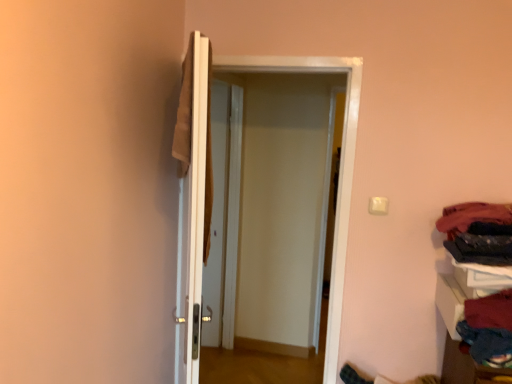
The width and height of the screenshot is (512, 384). Identify the location of velvet red sweater at lower right, which is the 1th clothing in bottom-to-top order. (488, 327).

Describe the element at coordinates (472, 216) in the screenshot. Image resolution: width=512 pixels, height=384 pixels. I see `dark blue fabric at right, the 3th clothing ordered from the bottom` at that location.

Where is `black fabric at right, positioned as the 2th clothing in bottom-to-top order`? This screenshot has width=512, height=384. black fabric at right, positioned as the 2th clothing in bottom-to-top order is located at coordinates (481, 249).

What are the coordinates of `velvet red sweater at lower right, which is the 1th clothing in bottom-to-top order` in the screenshot? It's located at (488, 327).

From a real-world perspective, who is located lower, dark blue fabric at right, the 3th clothing ordered from the bottom, or black fabric at right, arranged as the second clothing when viewed from the top?

black fabric at right, arranged as the second clothing when viewed from the top, from a real-world perspective.

Is point (473, 220) closer to viewer compared to point (457, 243)?

No, it is behind (457, 243).

Is dark blue fabric at right, which is the 1th clothing from top to bottom, in front of black fabric at right, positioned as the 2th clothing in bottom-to-top order?

No, it is not.

Is velvet red sweater at lower right, which is the 3th clothing in top-to-bottom order, oriented towards black fabric at right, arranged as the second clothing when viewed from the top?

No, velvet red sweater at lower right, which is the 3th clothing in top-to-bottom order, is not facing towards black fabric at right, arranged as the second clothing when viewed from the top.

Which point is more forward, (x=490, y=348) or (x=498, y=252)?

Point (x=490, y=348)

Is velvet red sweater at lower right, which is the 1th clothing in bottom-to-top order, positioned far away from black fabric at right, positioned as the 2th clothing in bottom-to-top order?

No, velvet red sweater at lower right, which is the 1th clothing in bottom-to-top order, is not far from black fabric at right, positioned as the 2th clothing in bottom-to-top order.

Is velvet red sweater at lower right, which is the 1th clothing in bottom-to-top order, wider than black fabric at right, arranged as the second clothing when viewed from the top?

Indeed, velvet red sweater at lower right, which is the 1th clothing in bottom-to-top order, has a greater width compared to black fabric at right, arranged as the second clothing when viewed from the top.

Can you confirm if velvet red sweater at lower right, which is the 1th clothing in bottom-to-top order, is wider than white glossy door at center, which is the second door from right to left?

Correct, the width of velvet red sweater at lower right, which is the 1th clothing in bottom-to-top order, exceeds that of white glossy door at center, which is the second door from right to left.

From the white glossy door at center, which is the second door from right to left, count 1st clothings backward and point to it. Please provide its 2D coordinates.

[(488, 327)]

Which is more to the right, velvet red sweater at lower right, which is the 1th clothing in bottom-to-top order, or white glossy door at center, which is the second door from right to left?

From the viewer's perspective, velvet red sweater at lower right, which is the 1th clothing in bottom-to-top order, appears more on the right side.

Is white glossy door at center, which is the second door from right to left, far away from black fabric at right, positioned as the 2th clothing in bottom-to-top order?

white glossy door at center, which is the second door from right to left, is far away from black fabric at right, positioned as the 2th clothing in bottom-to-top order.

What are the coordinates of `the 3rd clothing counting from the right of the white glossy door at center, which is the second door from right to left` in the screenshot? It's located at (481, 249).

Between white glossy door at center, which is the second door from right to left, and black fabric at right, arranged as the second clothing when viewed from the top, which one has more height?

white glossy door at center, which is the second door from right to left.

From a real-world perspective, relative to black fabric at right, arranged as the second clothing when viewed from the top, is white glossy door at center, which is counted as the first door, starting from the left, vertically above or below?

Clearly, from a real-world perspective, white glossy door at center, which is counted as the first door, starting from the left, is below black fabric at right, arranged as the second clothing when viewed from the top.

Between dark blue fabric at right, which is the 1th clothing from top to bottom, and velvet red sweater at lower right, which is the 1th clothing in bottom-to-top order, which one has larger width?

With larger width is dark blue fabric at right, which is the 1th clothing from top to bottom.

Considering the relative positions of dark blue fabric at right, the 3th clothing ordered from the bottom, and velvet red sweater at lower right, which is the 3th clothing in top-to-bottom order, in the image provided, is dark blue fabric at right, the 3th clothing ordered from the bottom, to the left or to the right of velvet red sweater at lower right, which is the 3th clothing in top-to-bottom order,?

In the image, dark blue fabric at right, the 3th clothing ordered from the bottom, appears on the right side of velvet red sweater at lower right, which is the 3th clothing in top-to-bottom order.

From a real-world perspective, between dark blue fabric at right, which is the 1th clothing from top to bottom, and velvet red sweater at lower right, which is the 3th clothing in top-to-bottom order, who is vertically higher?

dark blue fabric at right, which is the 1th clothing from top to bottom.

Is point (184, 257) positioned in front of point (182, 94)?

Yes.

From the image's perspective, is white glossy door at center, which is counted as the first door, starting from the right, on top of white glossy door at center, which is the second door from right to left?

Correct, white glossy door at center, which is counted as the first door, starting from the right, appears higher than white glossy door at center, which is the second door from right to left, in the image.

Based on their positions, is white glossy door at center, which is counted as the second door, starting from the left, located to the left or right of white glossy door at center, which is counted as the first door, starting from the left?

white glossy door at center, which is counted as the second door, starting from the left, is to the right of white glossy door at center, which is counted as the first door, starting from the left.

Locate an element on the screen. the 1st door to the left of the dark blue fabric at right, the 3th clothing ordered from the bottom, starting your count from the anchor is located at coordinates (192, 187).

Considering the sizes of objects dark blue fabric at right, the 3th clothing ordered from the bottom, and white glossy door at center, which is counted as the second door, starting from the left, in the image provided, who is thinner, dark blue fabric at right, the 3th clothing ordered from the bottom, or white glossy door at center, which is counted as the second door, starting from the left,?

With smaller width is white glossy door at center, which is counted as the second door, starting from the left.

Is the position of dark blue fabric at right, which is the 1th clothing from top to bottom, less distant than that of white glossy door at center, which is counted as the second door, starting from the left?

Yes.

Is dark blue fabric at right, the 3th clothing ordered from the bottom, aimed at white glossy door at center, which is counted as the second door, starting from the left?

No, dark blue fabric at right, the 3th clothing ordered from the bottom, does not turn towards white glossy door at center, which is counted as the second door, starting from the left.

Identify the location of clothing that is the 1st one when counting forward from the dark blue fabric at right, which is the 1th clothing from top to bottom. (481, 249).

From the velvet red sweater at lower right, which is the 3th clothing in top-to-bottom order, count 2nd clothing to the right and point to it. Please provide its 2D coordinates.

[(481, 249)]

When comparing their distances from black fabric at right, positioned as the 2th clothing in bottom-to-top order, does velvet red sweater at lower right, which is the 3th clothing in top-to-bottom order, or white glossy door at center, which is counted as the second door, starting from the left, seem closer?

The object closer to black fabric at right, positioned as the 2th clothing in bottom-to-top order, is velvet red sweater at lower right, which is the 3th clothing in top-to-bottom order.

Consider the image. Considering their positions, is white glossy door at center, which is counted as the second door, starting from the left, positioned further to black fabric at right, arranged as the second clothing when viewed from the top, than dark blue fabric at right, the 3th clothing ordered from the bottom?

white glossy door at center, which is counted as the second door, starting from the left, is further to black fabric at right, arranged as the second clothing when viewed from the top.

Which object lies nearer to the anchor point white glossy door at center, which is the second door from right to left, black fabric at right, arranged as the second clothing when viewed from the top, or dark blue fabric at right, the 3th clothing ordered from the bottom?

black fabric at right, arranged as the second clothing when viewed from the top, lies closer to white glossy door at center, which is the second door from right to left, than the other object.

From the image, which object appears to be farther from white glossy door at center, which is counted as the first door, starting from the right, black fabric at right, positioned as the 2th clothing in bottom-to-top order, or white glossy door at center, which is the second door from right to left?

black fabric at right, positioned as the 2th clothing in bottom-to-top order, is further to white glossy door at center, which is counted as the first door, starting from the right.

Considering their positions, is white glossy door at center, which is counted as the first door, starting from the right, positioned further to black fabric at right, arranged as the second clothing when viewed from the top, than white glossy door at center, which is the second door from right to left?

Among the two, white glossy door at center, which is the second door from right to left, is located further to black fabric at right, arranged as the second clothing when viewed from the top.

From the image, which object appears to be nearer to velvet red sweater at lower right, which is the 1th clothing in bottom-to-top order, white glossy door at center, which is counted as the second door, starting from the left, or black fabric at right, arranged as the second clothing when viewed from the top?

black fabric at right, arranged as the second clothing when viewed from the top, is positioned closer to the anchor velvet red sweater at lower right, which is the 1th clothing in bottom-to-top order.

Estimate the real-world distances between objects in this image. Which object is closer to velvet red sweater at lower right, which is the 1th clothing in bottom-to-top order, dark blue fabric at right, the 3th clothing ordered from the bottom, or black fabric at right, arranged as the second clothing when viewed from the top?

black fabric at right, arranged as the second clothing when viewed from the top.

Based on their spatial positions, is dark blue fabric at right, the 3th clothing ordered from the bottom, or white glossy door at center, which is counted as the first door, starting from the right, further from black fabric at right, arranged as the second clothing when viewed from the top?

white glossy door at center, which is counted as the first door, starting from the right, is further to black fabric at right, arranged as the second clothing when viewed from the top.

Locate an element on the screen. This screenshot has height=384, width=512. door between white glossy door at center, which is the second door from right to left, and velvet red sweater at lower right, which is the 1th clothing in bottom-to-top order, in the horizontal direction is located at coordinates (192, 187).

At what (x,y) coordinates should I click in order to perform the action: click on clothing situated between white glossy door at center, which is counted as the first door, starting from the left, and dark blue fabric at right, the 3th clothing ordered from the bottom, from left to right. Please return your answer as a coordinate pair (x, y). The image size is (512, 384). Looking at the image, I should click on (488, 327).

I want to click on door located between white glossy door at center, which is counted as the first door, starting from the left, and black fabric at right, positioned as the 2th clothing in bottom-to-top order, in the left-right direction, so click(x=192, y=187).

The width and height of the screenshot is (512, 384). Find the location of `door between white glossy door at center, which is counted as the first door, starting from the left, and dark blue fabric at right, the 3th clothing ordered from the bottom, in the horizontal direction`. door between white glossy door at center, which is counted as the first door, starting from the left, and dark blue fabric at right, the 3th clothing ordered from the bottom, in the horizontal direction is located at coordinates (192, 187).